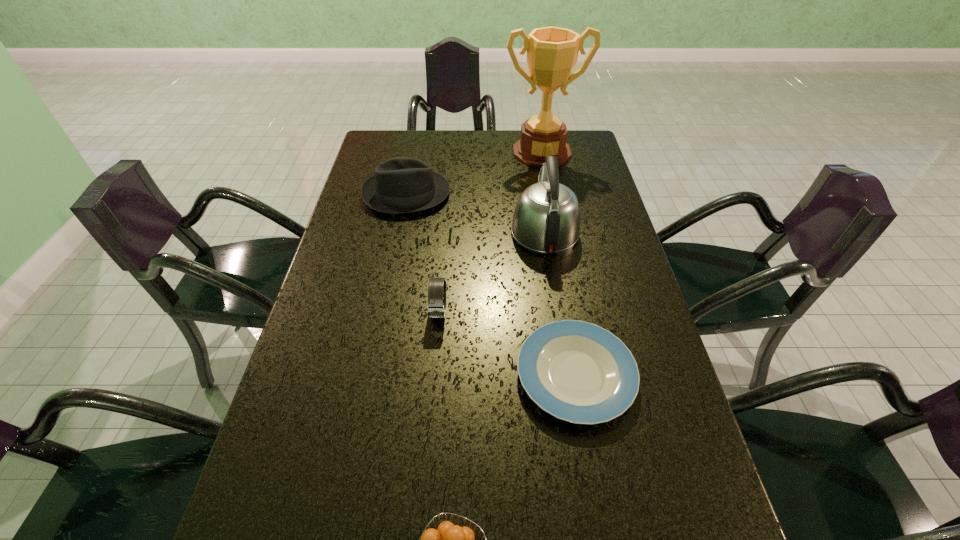
Locate an element on the screen. Image resolution: width=960 pixels, height=540 pixels. object that is the fourth closest to the watch is located at coordinates (448, 539).